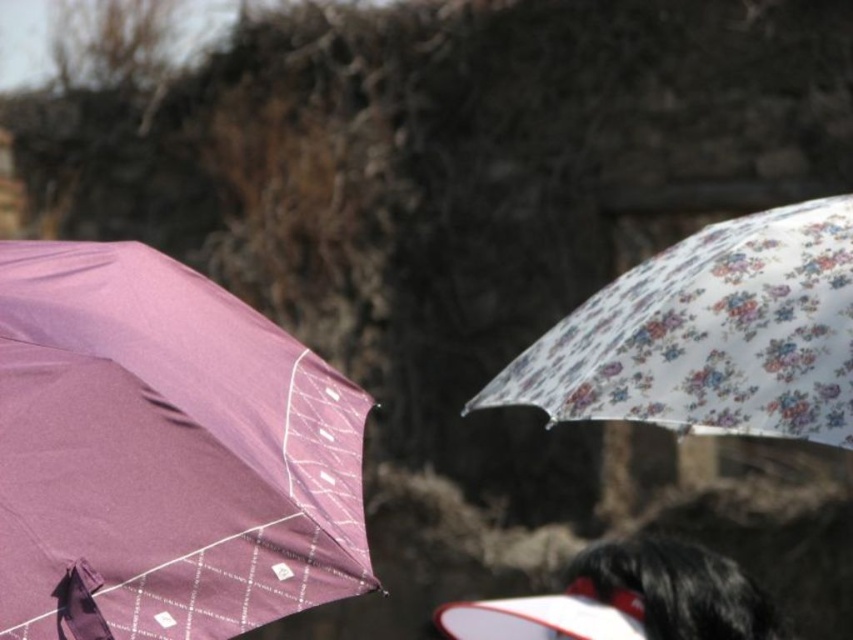
Is purple matte umbrella at left closer to the viewer compared to black fuzzy hair at lower right?

Yes, purple matte umbrella at left is in front of black fuzzy hair at lower right.

Between purple matte umbrella at left and black fuzzy hair at lower right, which one appears on the left side from the viewer's perspective?

Positioned to the left is purple matte umbrella at left.

Does point (320, 504) come farther from viewer compared to point (692, 636)?

That is False.

The width and height of the screenshot is (853, 640). In order to click on purple matte umbrella at left in this screenshot , I will do `click(166, 451)`.

From the picture: Can you confirm if purple matte umbrella at left is positioned above floral printed umbrella at right?

Actually, purple matte umbrella at left is below floral printed umbrella at right.

Image resolution: width=853 pixels, height=640 pixels. I want to click on purple matte umbrella at left, so click(166, 451).

Identify the location of purple matte umbrella at left. (166, 451).

Can you confirm if floral printed umbrella at right is positioned to the left of black fuzzy hair at lower right?

In fact, floral printed umbrella at right is to the right of black fuzzy hair at lower right.

Can you confirm if floral printed umbrella at right is taller than black fuzzy hair at lower right?

Correct, floral printed umbrella at right is much taller as black fuzzy hair at lower right.

You are a GUI agent. You are given a task and a screenshot of the screen. Output one action in this format:
    pyautogui.click(x=<x>, y=<y>)
    Task: Click on the floral printed umbrella at right
    
    Given the screenshot: What is the action you would take?
    pyautogui.click(x=711, y=336)